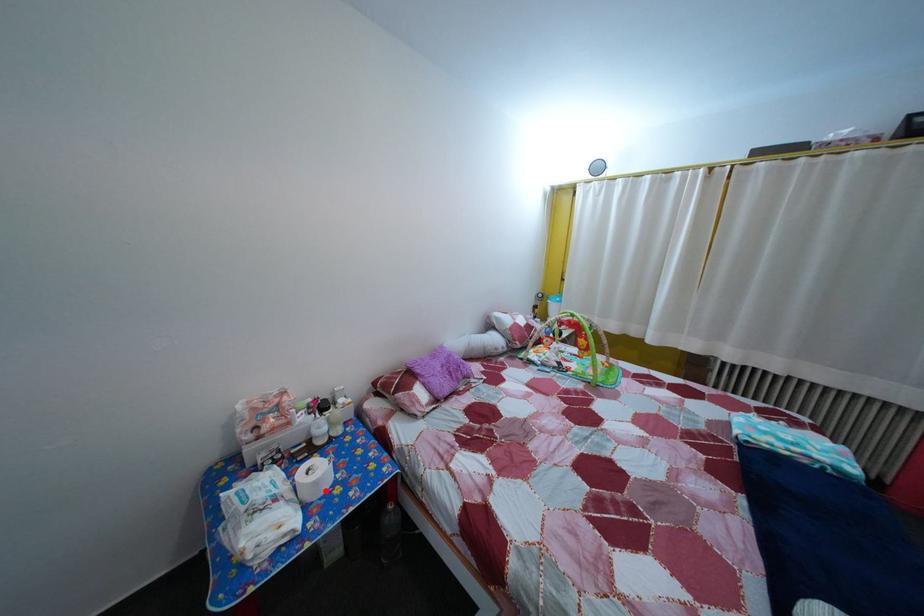
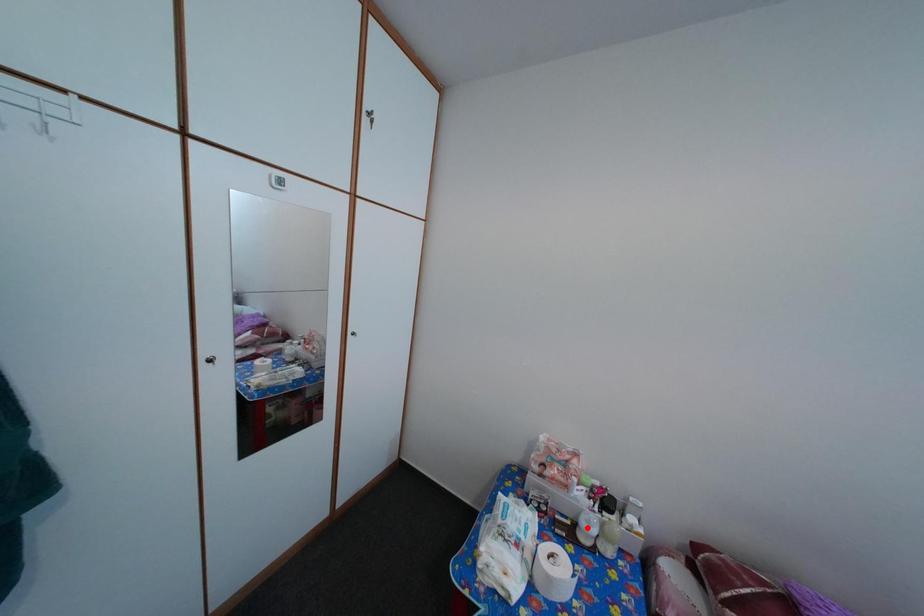
I am providing you with two images of the same scene from different viewpoints. A red point is marked on the first image and another point is marked on the second image. Are the points marked in image1 and image2 representing the same 3D position?

No